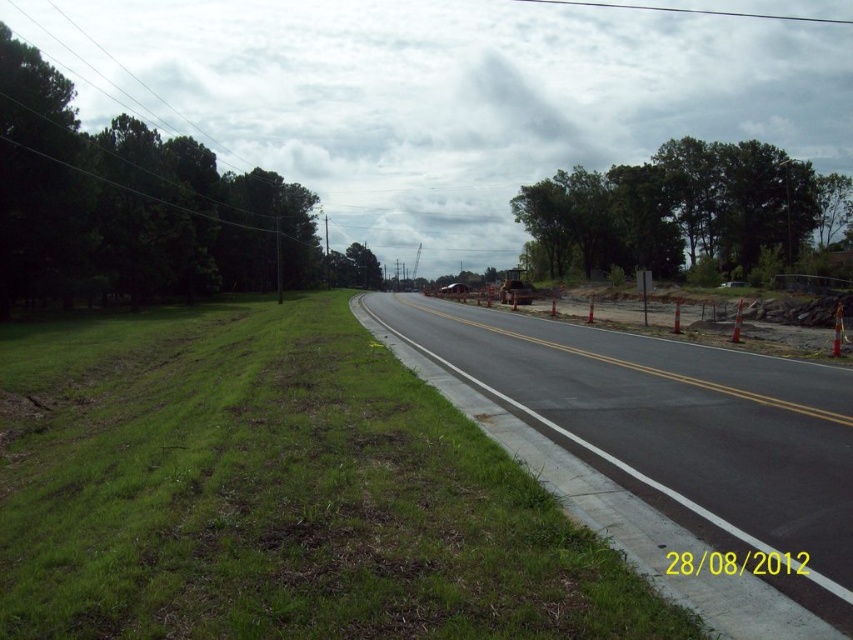
Is point (322, 435) positioned behind point (496, 385)?

That is False.

Is point (447, 403) closer to viewer compared to point (529, 406)?

Yes, it is in front of point (529, 406).

At what (x,y) coordinates should I click in order to perform the action: click on green grass at lower left. Please return your answer as a coordinate pair (x, y). Looking at the image, I should click on (276, 493).